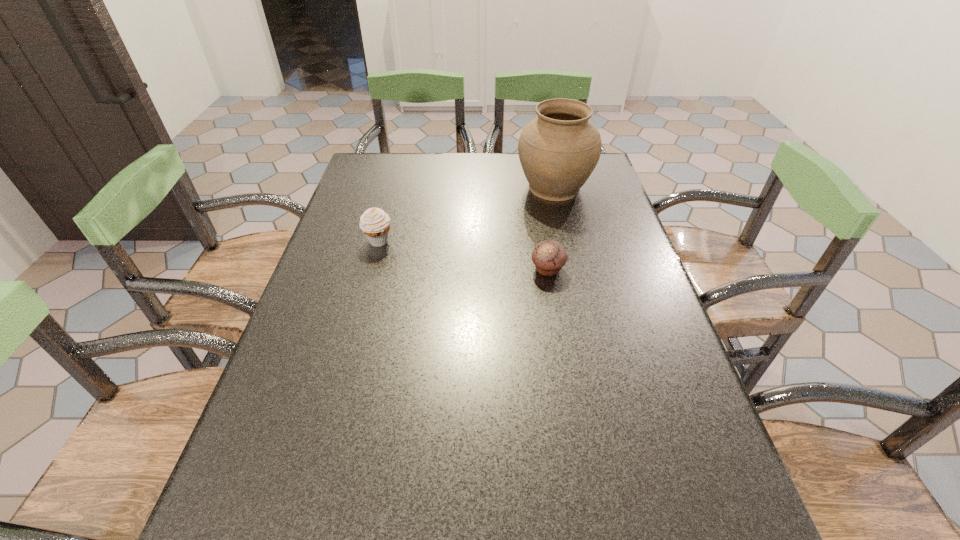
I want to click on the farthest object, so click(558, 151).

Find the location of a particular element. The width and height of the screenshot is (960, 540). urn is located at coordinates (558, 151).

Where is `the farther muffin`? the farther muffin is located at coordinates (375, 223).

This screenshot has width=960, height=540. What are the coordinates of `the taller muffin` in the screenshot? It's located at (375, 223).

Identify the location of the shorter muffin. (549, 256).

Image resolution: width=960 pixels, height=540 pixels. I want to click on the nearer muffin, so click(549, 256).

This screenshot has width=960, height=540. I want to click on free space located on the front of the farthest object, so pos(576,283).

Find the location of a particular element. Image resolution: width=960 pixels, height=540 pixels. vacant space positioned on the right of the second farthest object is located at coordinates (472, 242).

This screenshot has width=960, height=540. In order to click on free spot located 0.380m on the back of the nearer muffin in this screenshot , I will do `click(533, 180)`.

Identify the location of object that is at the far edge. The width and height of the screenshot is (960, 540). (558, 151).